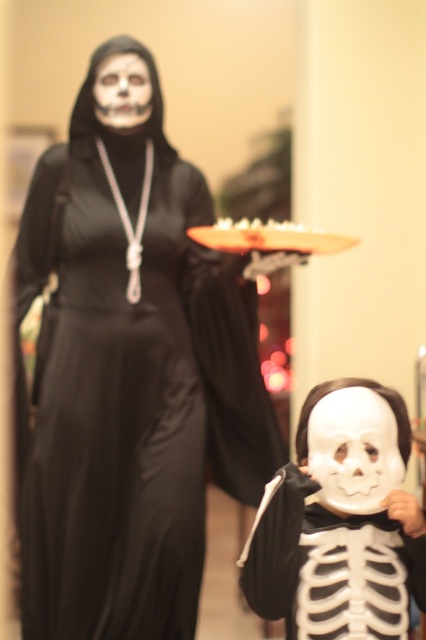
You are standing in a Halloween party and see the black satin dress at upper left. Can you tell me its exact coordinates in the image?

The black satin dress at upper left is located at coordinates point (129,372).

You are a photographer at a Halloween party. You need to position the black satin dress at upper left and the white matte mask at lower center in your shot. Based on their positions, which object is higher in the frame?

The black satin dress at upper left is higher in the frame than the white matte mask at lower center because it is located above it.

You are at a costume party and need to locate the black satin dress at upper left and the white matte mask at lower center. Which object is positioned to the left of the other?

The black satin dress at upper left is to the left of the white matte mask at lower center.